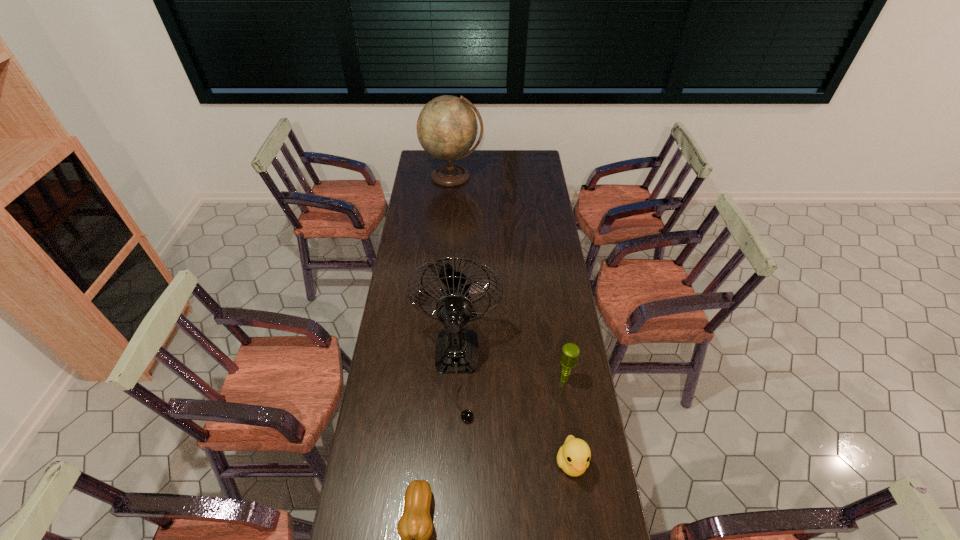
Identify the location of vacant area that lies between the duck and the third shortest object. The image size is (960, 540). (568, 421).

The image size is (960, 540). I want to click on free space between the microphone and the fourth farthest object, so click(568, 421).

Find the location of a particular element. The image size is (960, 540). vacant region between the third tallest object and the fourth tallest object is located at coordinates (568, 421).

The width and height of the screenshot is (960, 540). Find the location of `vacant area that lies between the microphone and the fan`. vacant area that lies between the microphone and the fan is located at coordinates (511, 374).

Identify the location of free point between the duck and the fan. This screenshot has width=960, height=540. (514, 415).

In order to click on free space between the third tallest object and the fan in this screenshot , I will do `click(511, 374)`.

Find the location of a particular element. This screenshot has width=960, height=540. object identified as the fourth closest to the farthest object is located at coordinates (415, 526).

What are the coordinates of `object that is the closest to the fan` in the screenshot? It's located at (573, 457).

I want to click on free spot that satisfies the following two spatial constraints: 1. in front of the third tallest object, indicating the direction of air flow; 2. on the right side of the fan, so click(456, 380).